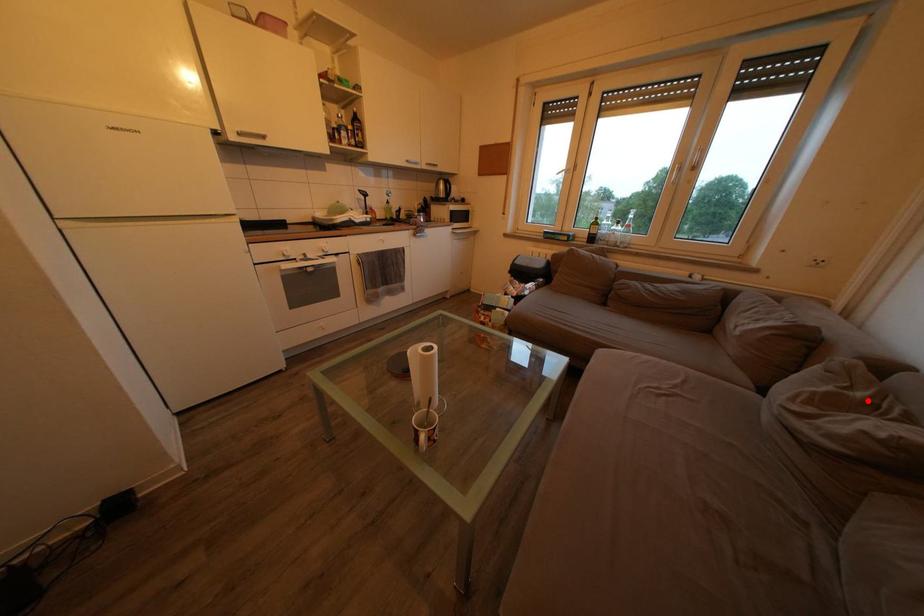
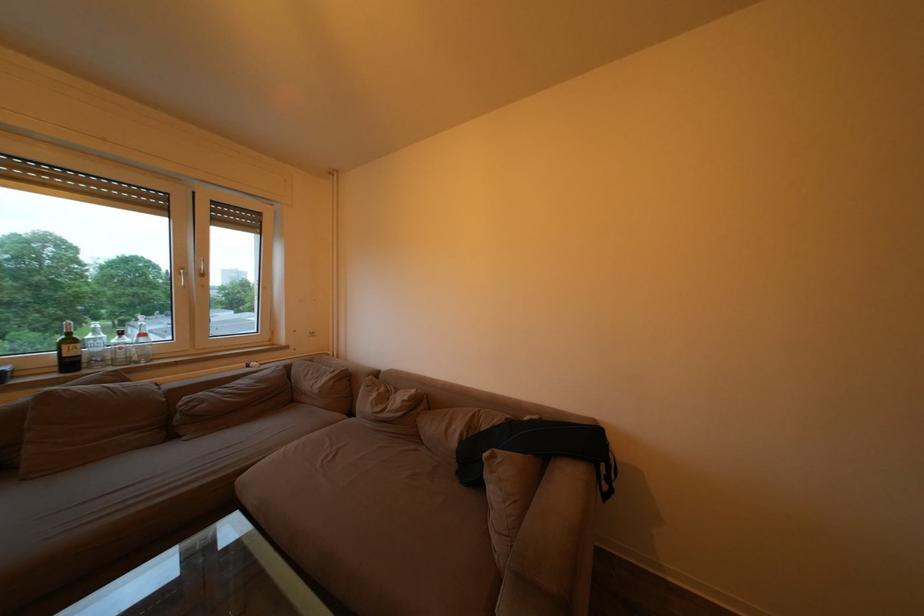
The point at the highlighted location is marked in the first image. Where is the corresponding point in the second image?

(390, 395)